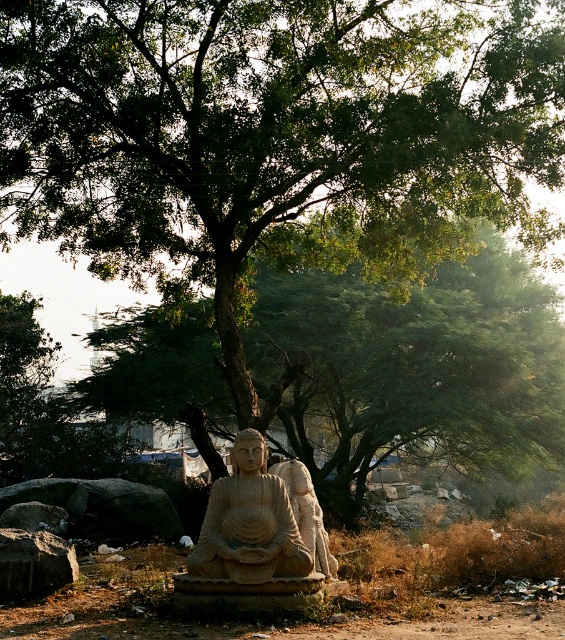
Can you confirm if sandy beige statue at center is taller than rough gray rock at lower left?

Indeed, sandy beige statue at center has a greater height compared to rough gray rock at lower left.

Is sandy beige statue at center behind rough gray rock at lower left?

No, sandy beige statue at center is in front of rough gray rock at lower left.

Measure the distance between sandy beige statue at center and camera.

sandy beige statue at center and camera are 10.86 meters apart from each other.

The image size is (565, 640). Identify the location of sandy beige statue at center. (249, 522).

Can you confirm if brown dirt field at center is thinner than rough gray rock at lower left?

Incorrect, brown dirt field at center's width is not less than rough gray rock at lower left's.

Is brown dirt field at center wider than rough gray rock at lower left?

Yes, brown dirt field at center is wider than rough gray rock at lower left.

Does point (515, 522) come behind point (76, 564)?

Yes, point (515, 522) is behind point (76, 564).

The width and height of the screenshot is (565, 640). I want to click on brown dirt field at center, so click(x=328, y=592).

The image size is (565, 640). What do you see at coordinates (33, 563) in the screenshot?
I see `rough gray rock at lower left` at bounding box center [33, 563].

Based on the photo, can you confirm if rough gray rock at lower left is wider than carved stone statue at center?

Yes.

Is point (3, 529) positioned in front of point (310, 516)?

That is True.

Locate an element on the screen. The image size is (565, 640). rough gray rock at lower left is located at coordinates (33, 563).